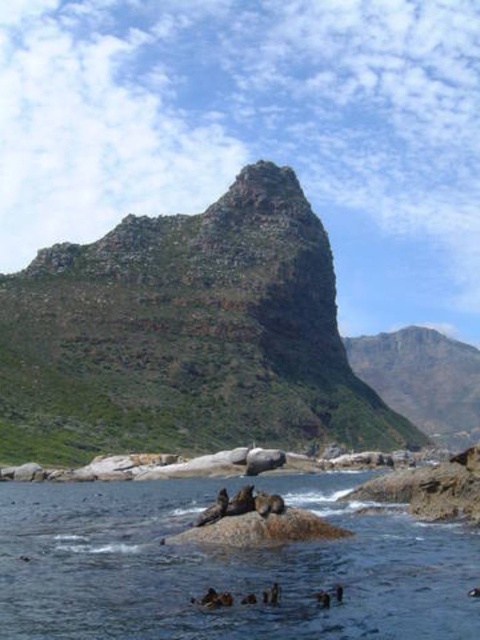
You are standing at the point marked by the coordinates point (186, 336). Looking around, you see the rugged rock mountain at center. Can you determine if you are standing on the rugged rock mountain at center or on the ground below it?

The point (186, 336) represents the rugged rock mountain at center, so you are standing on the rugged rock mountain at center itself.

You are a hiker who wants to cross from the rugged rock mountain at center to the brown textured water at center. Given that your hiking boots can handle a maximum distance of 300 feet, can you safely make the jump?

The distance between the rugged rock mountain at center and the brown textured water at center is 330.64 feet, which exceeds your hiking boots maximum distance of 300 feet. Therefore, you cannot safely make the jump.

You are standing on the beach and want to take a photo of both the brown textured water at center and the green rocky mountain at center. Since you have a wide angle lens, which object should you position closer to the edge of the frame to ensure both fit in the shot?

You should position the brown textured water at center closer to the edge of the frame because it has a lesser width compared to the green rocky mountain at center, allowing more space for the wider mountain in the shot.